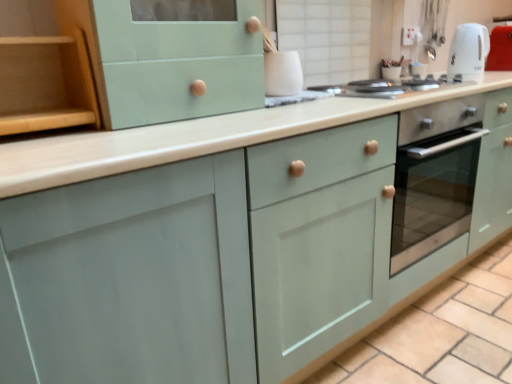
The height and width of the screenshot is (384, 512). Find the location of `white glossy electric kettle at upper right`. white glossy electric kettle at upper right is located at coordinates (468, 52).

The height and width of the screenshot is (384, 512). What do you see at coordinates (404, 339) in the screenshot?
I see `matte green cabinet at center` at bounding box center [404, 339].

Where is `white glossy stovetop at upper center`? This screenshot has height=384, width=512. white glossy stovetop at upper center is located at coordinates (387, 86).

Find the location of a particular element. This screenshot has width=512, height=384. white glossy kettle at upper right, acting as the 2th appliance starting from the left is located at coordinates (500, 49).

Where is `white glossy electric kettle at upper right`? The width and height of the screenshot is (512, 384). white glossy electric kettle at upper right is located at coordinates (468, 52).

Where is `tile below the white glossy kettle at upper center, acting as the 2th appliance starting from the right (from the image's perspective)`? This screenshot has width=512, height=384. tile below the white glossy kettle at upper center, acting as the 2th appliance starting from the right (from the image's perspective) is located at coordinates (x=404, y=339).

From the image's perspective, is white glossy kettle at upper center, the first appliance viewed from the front, located beneath matte green cabinet at center?

No, from the image's perspective, white glossy kettle at upper center, the first appliance viewed from the front, is not below matte green cabinet at center.

From a real-world perspective, which object stands above the other?

From a 3D spatial view, white glossy kettle at upper center, the first appliance in the left-to-right sequence, is above.

Considering the sizes of white glossy kettle at upper center, the first appliance viewed from the front, and matte green cabinet at center in the image, is white glossy kettle at upper center, the first appliance viewed from the front, wider or thinner than matte green cabinet at center?

In the image, white glossy kettle at upper center, the first appliance viewed from the front, appears to be more narrow than matte green cabinet at center.

How much distance is there between white glossy kettle at upper right, marked as the 1th appliance in a back-to-front arrangement, and matte green cabinet at center?

white glossy kettle at upper right, marked as the 1th appliance in a back-to-front arrangement, is 4.09 feet away from matte green cabinet at center.

Which of these two, white glossy kettle at upper right, the 2th appliance in the bottom-to-top sequence, or matte green cabinet at center, is wider?

matte green cabinet at center is wider.

Which point is more distant from viewer, (490, 68) or (351, 369)?

The point (490, 68) is farther from the camera.

Is white glossy kettle at upper right, marked as the 1th appliance in a back-to-front arrangement, in front of or behind matte green cabinet at center in the image?

Clearly, white glossy kettle at upper right, marked as the 1th appliance in a back-to-front arrangement, is behind matte green cabinet at center.

Which is closer, (372, 81) or (276, 92)?

Point (372, 81) is positioned farther from the camera compared to point (276, 92).

Between white glossy stovetop at upper center and white glossy kettle at upper center, acting as the 2th appliance starting from the right, which one has less height?

Standing shorter between the two is white glossy stovetop at upper center.

Is white glossy stovetop at upper center at the left side of white glossy kettle at upper center, the first appliance from the bottom?

No, white glossy stovetop at upper center is not to the left of white glossy kettle at upper center, the first appliance from the bottom.

Could you tell me if white glossy stovetop at upper center is facing white glossy kettle at upper center, the first appliance viewed from the front?

No.

From the image's perspective, who appears lower, matte green cabinet at center or white glossy kettle at upper center, the first appliance from the bottom?

matte green cabinet at center, from the image's perspective.

Where is `tile in front of the white glossy kettle at upper center, acting as the 2th appliance starting from the right`? This screenshot has height=384, width=512. tile in front of the white glossy kettle at upper center, acting as the 2th appliance starting from the right is located at coordinates (404, 339).

From a real-world perspective, is matte green cabinet at center positioned under white glossy kettle at upper center, the 2th appliance in the top-to-bottom sequence, based on gravity?

Correct, in the physical world, matte green cabinet at center is lower than white glossy kettle at upper center, the 2th appliance in the top-to-bottom sequence.

Which is more to the right, wooden shelf at left or white glossy kettle at upper center, the first appliance viewed from the front?

white glossy kettle at upper center, the first appliance viewed from the front.

Is wooden shelf at left bigger than white glossy kettle at upper center, the first appliance from the bottom?

Correct, wooden shelf at left is larger in size than white glossy kettle at upper center, the first appliance from the bottom.

The image size is (512, 384). Identify the location of the 1st appliance above the wooden shelf at left (from the image's perspective). (282, 73).

From a real-world perspective, which is physically above, wooden shelf at left or white glossy kettle at upper center, the first appliance in the left-to-right sequence?

wooden shelf at left.

From the image's perspective, which one is positioned lower, matte green cabinet at center or wooden shelf at left?

matte green cabinet at center is shown below in the image.

In order to click on cabinetry located above the matte green cabinet at center (from a real-world perspective) in this screenshot , I will do `click(42, 71)`.

Is matte green cabinet at center wider than wooden shelf at left?

Indeed, matte green cabinet at center has a greater width compared to wooden shelf at left.

Where is `appliance located on the left of white glossy kettle at upper right, arranged as the 2th appliance when viewed from the front`? The width and height of the screenshot is (512, 384). appliance located on the left of white glossy kettle at upper right, arranged as the 2th appliance when viewed from the front is located at coordinates (282, 73).

Is the position of white glossy kettle at upper right, arranged as the 1th appliance when viewed from the top, more distant than that of white glossy kettle at upper center, positioned as the second appliance in back-to-front order?

Yes, white glossy kettle at upper right, arranged as the 1th appliance when viewed from the top, is behind white glossy kettle at upper center, positioned as the second appliance in back-to-front order.

Could you tell me if white glossy kettle at upper right, arranged as the 2th appliance when viewed from the front, is facing white glossy kettle at upper center, the first appliance from the bottom?

No, white glossy kettle at upper right, arranged as the 2th appliance when viewed from the front, is not turned towards white glossy kettle at upper center, the first appliance from the bottom.

From the picture: From a real-world perspective, which object stands above the other?

From a 3D spatial view, white glossy kettle at upper right, arranged as the 1th appliance when viewed from the top, is above.

This screenshot has width=512, height=384. There is a matte green cabinet at center. In order to click on the 1st appliance above it (from the image's perspective) in this screenshot , I will do `click(282, 73)`.

The width and height of the screenshot is (512, 384). Find the location of `tile located below the white glossy kettle at upper right, placed as the 1th appliance when sorted from right to left (from the image's perspective)`. tile located below the white glossy kettle at upper right, placed as the 1th appliance when sorted from right to left (from the image's perspective) is located at coordinates (404, 339).

Looking at the image, which one is located further to white glossy kettle at upper center, acting as the 2th appliance starting from the right, white glossy stovetop at upper center or white glossy electric kettle at upper right?

Based on the image, white glossy electric kettle at upper right appears to be further to white glossy kettle at upper center, acting as the 2th appliance starting from the right.

From the image, which object appears to be farther from wooden shelf at left, white glossy kettle at upper right, the 2th appliance in the bottom-to-top sequence, or matte green cabinet at center?

The object further to wooden shelf at left is white glossy kettle at upper right, the 2th appliance in the bottom-to-top sequence.

From the image, which object appears to be farther from white glossy electric kettle at upper right, wooden shelf at left or matte green cabinet at center?

wooden shelf at left.

From the image, which object appears to be nearer to white glossy stovetop at upper center, white glossy electric kettle at upper right or wooden shelf at left?

The object closer to white glossy stovetop at upper center is white glossy electric kettle at upper right.

Looking at this image, from the image, which object appears to be farther from white glossy stovetop at upper center, white glossy kettle at upper right, the 2th appliance in the bottom-to-top sequence, or wooden shelf at left?

The object further to white glossy stovetop at upper center is wooden shelf at left.

Looking at the image, which one is located further to matte green cabinet at center, wooden shelf at left or white glossy kettle at upper right, acting as the 2th appliance starting from the left?

wooden shelf at left is positioned further to the anchor matte green cabinet at center.

Estimate the real-world distances between objects in this image. Which object is further from wooden shelf at left, white glossy kettle at upper right, arranged as the 1th appliance when viewed from the top, or white glossy stovetop at upper center?

white glossy kettle at upper right, arranged as the 1th appliance when viewed from the top, is further to wooden shelf at left.

Considering their positions, is white glossy kettle at upper center, the first appliance viewed from the front, positioned further to white glossy stovetop at upper center than white glossy kettle at upper right, the 2th appliance in the bottom-to-top sequence?

white glossy kettle at upper right, the 2th appliance in the bottom-to-top sequence.

I want to click on home appliance between white glossy electric kettle at upper right and matte green cabinet at center in the vertical direction, so click(x=387, y=86).

Find the location of a particular element. kitchen appliance between white glossy stovetop at upper center and white glossy kettle at upper right, marked as the 1th appliance in a back-to-front arrangement, from left to right is located at coordinates (468, 52).

Where is `home appliance between white glossy kettle at upper center, the 2th appliance in the top-to-bottom sequence, and white glossy kettle at upper right, arranged as the 1th appliance when viewed from the top`? home appliance between white glossy kettle at upper center, the 2th appliance in the top-to-bottom sequence, and white glossy kettle at upper right, arranged as the 1th appliance when viewed from the top is located at coordinates (387, 86).

The height and width of the screenshot is (384, 512). What are the coordinates of `home appliance between wooden shelf at left and white glossy kettle at upper right, the 2th appliance in the bottom-to-top sequence, from left to right` in the screenshot? It's located at (387, 86).